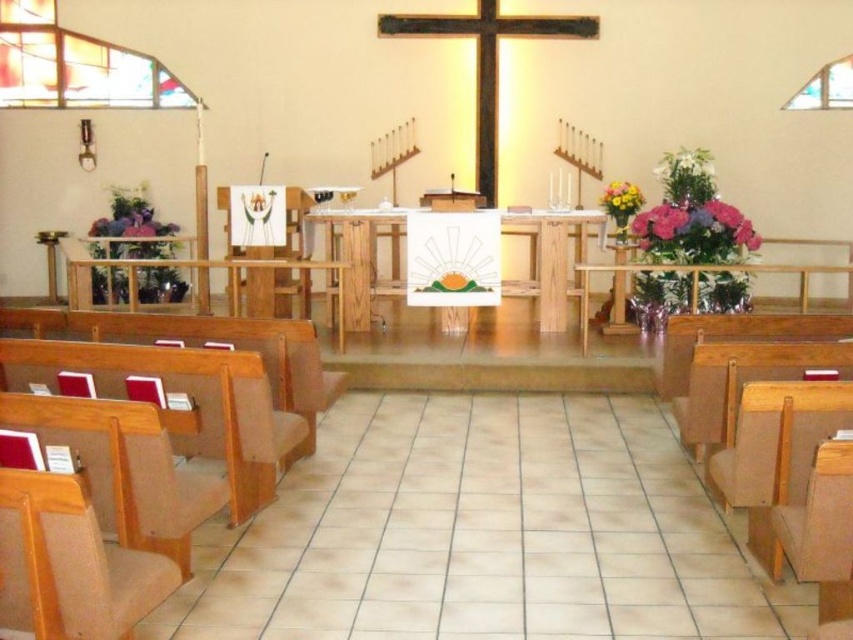
Question: Which object is the farthest from the light brown wood church bench at lower left?

Choices:
 (A) light brown wood chair at lower left
 (B) wooden cross at center
 (C) brown leather chair at right

Answer: (B)

Question: Which object is farther from the camera taking this photo?

Choices:
 (A) light brown wood chair at lower left
 (B) wooden cross at center

Answer: (B)

Question: Is brown leather chair at right to the left of wooden cross at center from the viewer's perspective?

Choices:
 (A) no
 (B) yes

Answer: (A)

Question: In this image, where is light brown wood church bench at lower left located relative to wooden cross at center?

Choices:
 (A) above
 (B) below

Answer: (B)

Question: Can you confirm if brown leather chair at right is positioned above light brown wood chair at lower left?

Choices:
 (A) no
 (B) yes

Answer: (B)

Question: Which point is closer to the camera?

Choices:
 (A) light brown wood chair at lower left
 (B) brown leather chair at right
 (C) wooden cross at center
 (D) light brown wood church bench at lower left

Answer: (A)